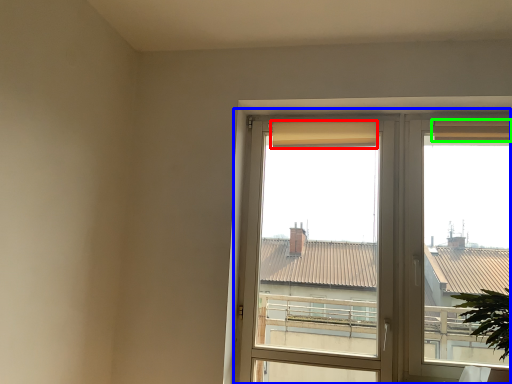
Question: Which object is the closest to the curtain (highlighted by a red box)? Choose among these: window (highlighted by a blue box) or curtain (highlighted by a green box).

Choices:
 (A) window
 (B) curtain

Answer: (A)